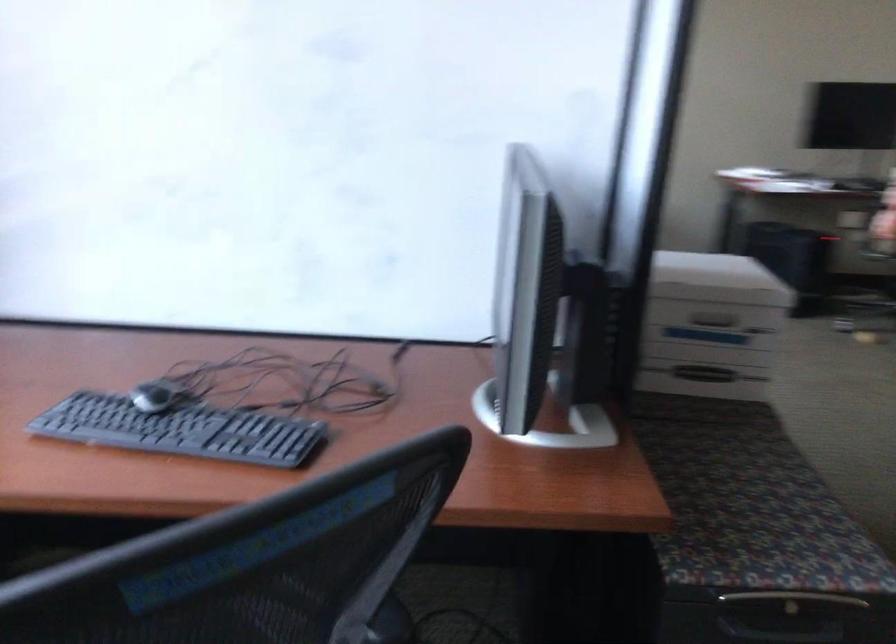
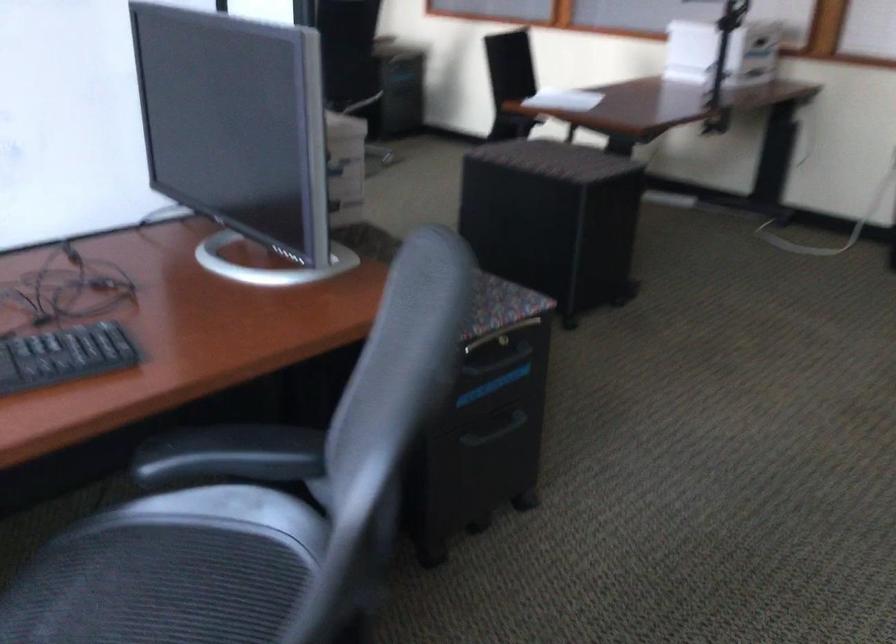
Question: The camera is either moving clockwise (left) or counter-clockwise (right) around the object. The first image is from the beginning of the video and the second image is from the end. Is the camera moving left or right when shooting the video?

Choices:
 (A) Left
 (B) Right

Answer: (A)